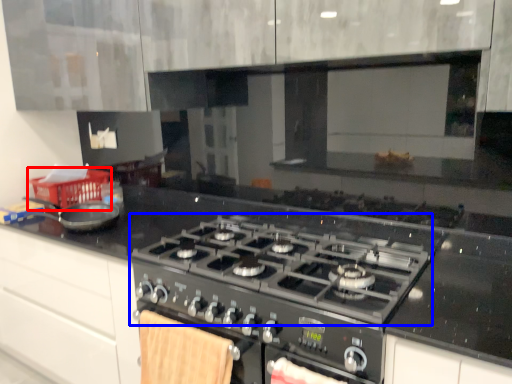
Question: Which of the following is the farthest to the observer, basket (highlighted by a red box) or gas stove (highlighted by a blue box)?

Choices:
 (A) basket
 (B) gas stove

Answer: (A)